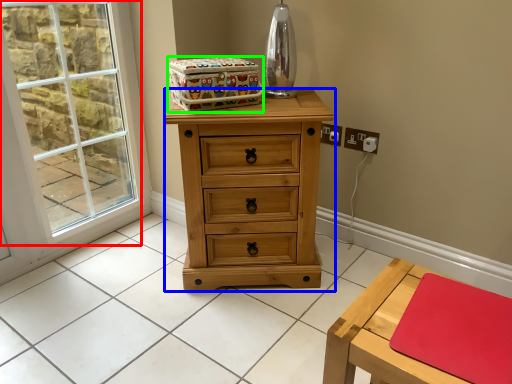
Question: Considering the real-world distances, which object is farthest from window (highlighted by a red box)? chest of drawers (highlighted by a blue box) or storage box (highlighted by a green box)?

Choices:
 (A) chest of drawers
 (B) storage box

Answer: (B)